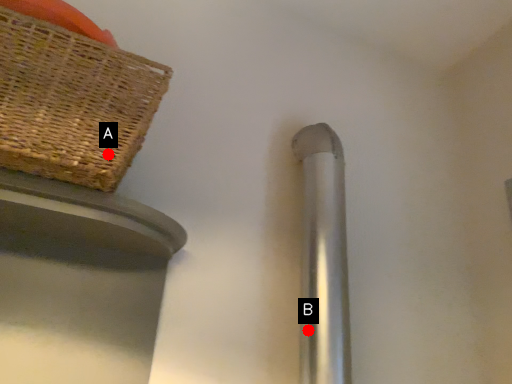
Question: Two points are circled on the image, labeled by A and B beside each circle. Among these points, which one is farthest from the camera?

Choices:
 (A) A is further
 (B) B is further

Answer: (B)